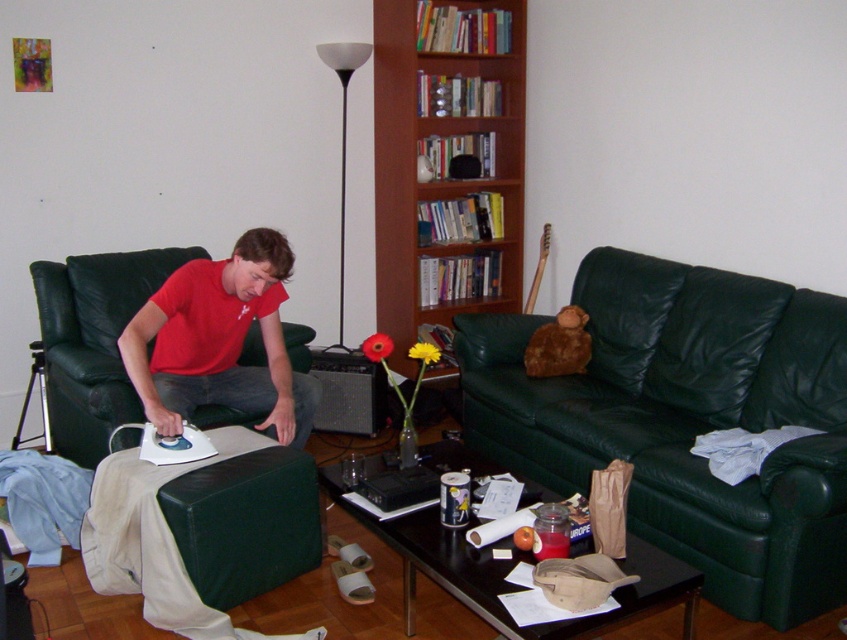
Question: Among these objects, which one is farthest from the camera?

Choices:
 (A) matte red shirt at center
 (B) wooden bookshelf at center

Answer: (B)

Question: Can you confirm if green leather couch at center is positioned below wooden bookshelf at center?

Choices:
 (A) no
 (B) yes

Answer: (B)

Question: Which object is closer to the camera taking this photo?

Choices:
 (A) wooden bookshelf at center
 (B) matte red shirt at center

Answer: (B)

Question: Based on their relative distances, which object is nearer to the matte red shirt at center?

Choices:
 (A) green leather couch at center
 (B) wooden bookshelf at center

Answer: (A)

Question: Is the position of green leather couch at center more distant than that of wooden bookshelf at center?

Choices:
 (A) yes
 (B) no

Answer: (B)

Question: Can you confirm if wooden bookshelf at center is smaller than matte red shirt at center?

Choices:
 (A) yes
 (B) no

Answer: (B)